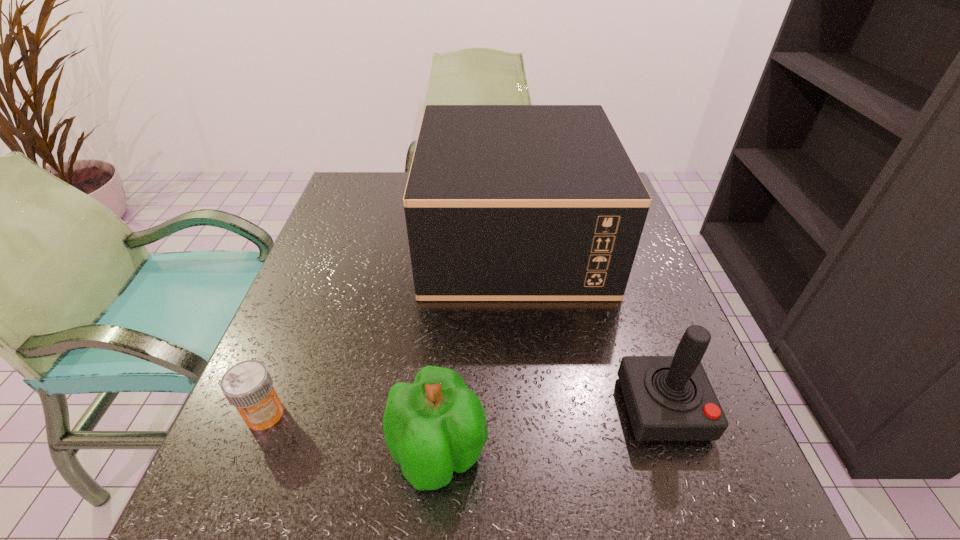
Find the location of a particular element. The width and height of the screenshot is (960, 540). free space that satisfies the following two spatial constraints: 1. on the label side of the shortest object; 2. on the left side of the bell pepper is located at coordinates (249, 454).

Where is `vacant space that satisfies the following two spatial constraints: 1. on the label side of the bell pepper; 2. on the left side of the shortest object`? The height and width of the screenshot is (540, 960). vacant space that satisfies the following two spatial constraints: 1. on the label side of the bell pepper; 2. on the left side of the shortest object is located at coordinates (249, 454).

At what (x,y) coordinates should I click in order to perform the action: click on free region that satisfies the following two spatial constraints: 1. on the front-facing side of the box; 2. on the label side of the leftmost object. Please return your answer as a coordinate pair (x, y). The width and height of the screenshot is (960, 540). Looking at the image, I should click on pos(530,414).

I want to click on free spot that satisfies the following two spatial constraints: 1. on the front-facing side of the box; 2. on the label side of the medicine, so click(530, 414).